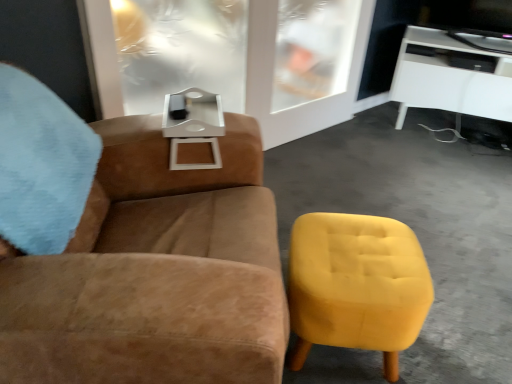
This screenshot has height=384, width=512. Find the location of `free space above yellow fabric ottoman at lower right (from a real-world perspective)`. free space above yellow fabric ottoman at lower right (from a real-world perspective) is located at coordinates (362, 258).